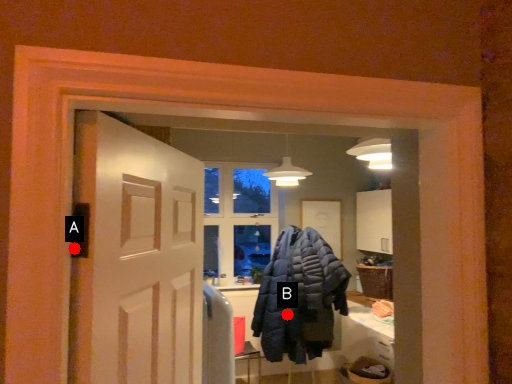
Question: Two points are circled on the image, labeled by A and B beside each circle. Which point appears closest to the camera in this image?

Choices:
 (A) A is closer
 (B) B is closer

Answer: (A)